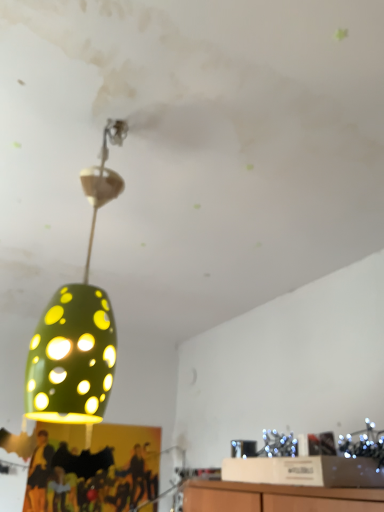
Question: Does yellow fabric person at lower left turn towards green matte lampshade at center?

Choices:
 (A) no
 (B) yes

Answer: (A)

Question: Is there a large distance between yellow fabric person at lower left and green matte lampshade at center?

Choices:
 (A) no
 (B) yes

Answer: (B)

Question: Is yellow fabric person at lower left at the left side of green matte lampshade at center?

Choices:
 (A) no
 (B) yes

Answer: (B)

Question: Is yellow fabric person at lower left positioned before green matte lampshade at center?

Choices:
 (A) yes
 (B) no

Answer: (B)

Question: Is yellow fabric person at lower left smaller than green matte lampshade at center?

Choices:
 (A) no
 (B) yes

Answer: (B)

Question: In terms of size, does green matte/porcelain lampshade at upper left appear bigger or smaller than green matte lampshade at center?

Choices:
 (A) small
 (B) big

Answer: (A)

Question: Is green matte/porcelain lampshade at upper left wider or thinner than green matte lampshade at center?

Choices:
 (A) wide
 (B) thin

Answer: (B)

Question: In terms of height, does green matte/porcelain lampshade at upper left look taller or shorter compared to green matte lampshade at center?

Choices:
 (A) short
 (B) tall

Answer: (B)

Question: Visually, is green matte/porcelain lampshade at upper left positioned to the left or to the right of green matte lampshade at center?

Choices:
 (A) right
 (B) left

Answer: (B)

Question: Does point (198, 65) appear closer or farther from the camera than point (94, 305)?

Choices:
 (A) closer
 (B) farther

Answer: (B)

Question: From the image's perspective, is green matte lampshade at center above or below green matte/porcelain lampshade at upper left?

Choices:
 (A) below
 (B) above

Answer: (B)

Question: In terms of width, does green matte lampshade at center look wider or thinner when compared to green matte/porcelain lampshade at upper left?

Choices:
 (A) wide
 (B) thin

Answer: (A)

Question: In the image, is green matte lampshade at center positioned in front of or behind green matte/porcelain lampshade at upper left?

Choices:
 (A) behind
 (B) front

Answer: (B)

Question: From a real-world perspective, relative to green matte/porcelain lampshade at upper left, is yellow fabric person at lower left vertically above or below?

Choices:
 (A) below
 (B) above

Answer: (A)

Question: In terms of width, does yellow fabric person at lower left look wider or thinner when compared to green matte/porcelain lampshade at upper left?

Choices:
 (A) wide
 (B) thin

Answer: (B)